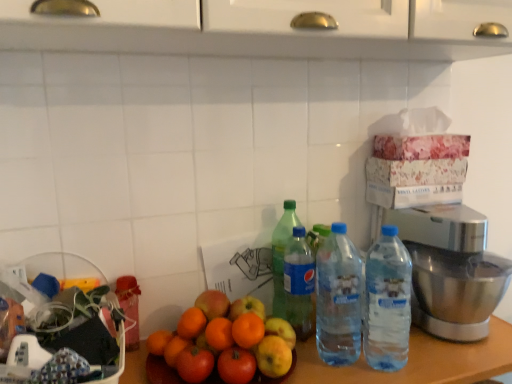
I want to click on vacant area that is in front of polished stainless steel mixer at right, so click(455, 358).